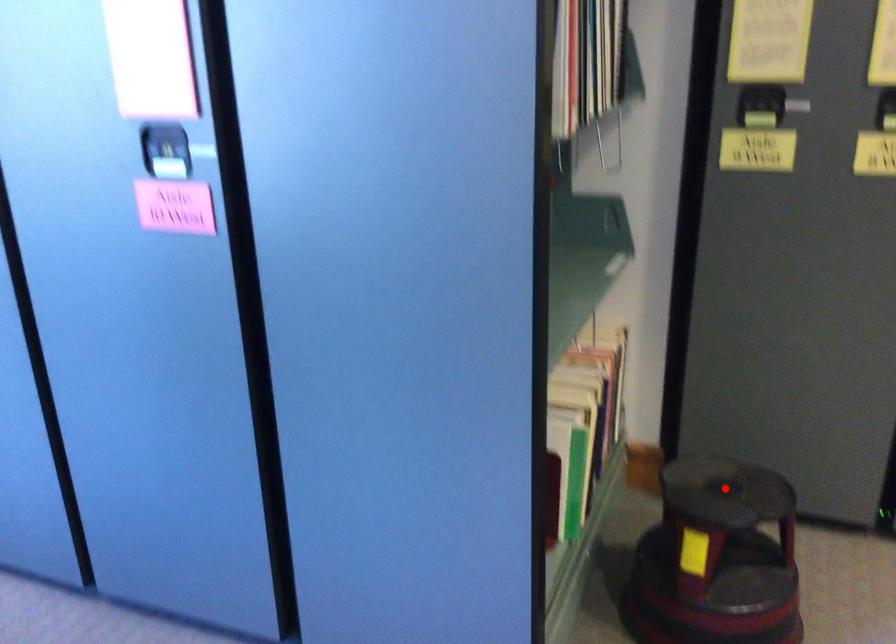
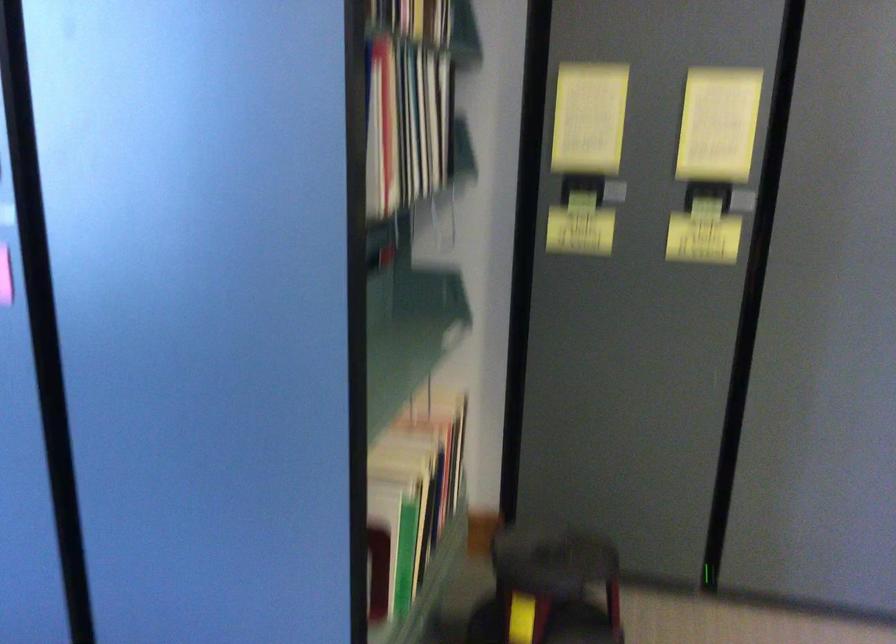
In the second image, find the point that corresponds to the highlighted location in the first image.

(552, 558)